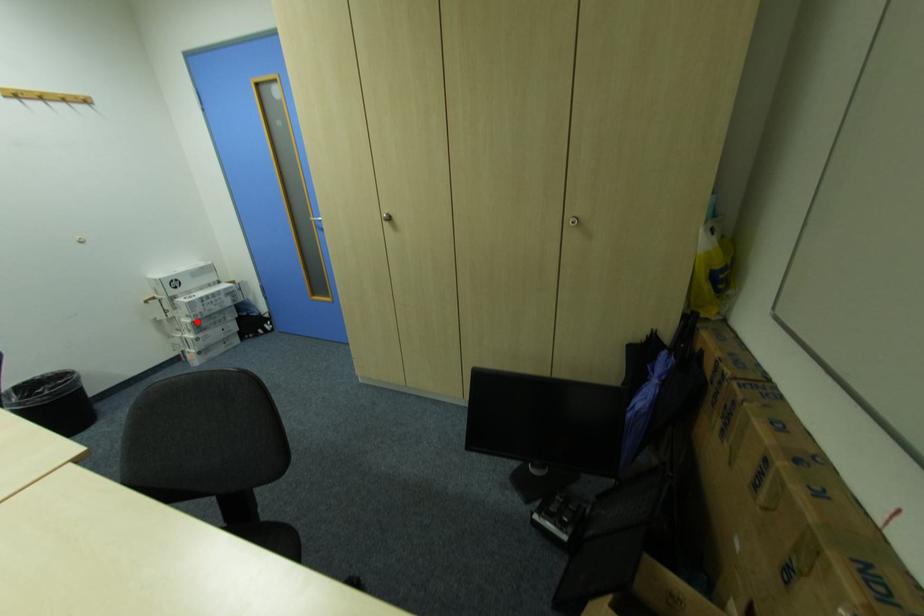
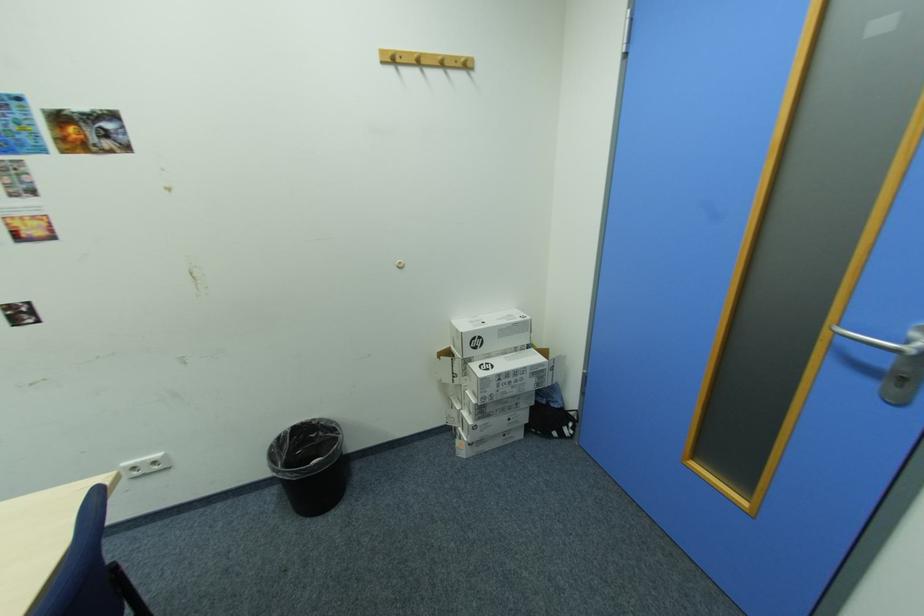
Where in the second image is the point corresponding to the highlighted location from the first image?

(481, 400)